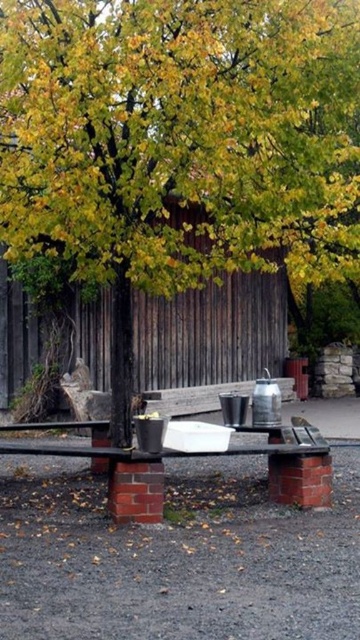
Which is more to the left, green leafy tree at center or wooden bench at center?

Positioned to the left is wooden bench at center.

Between green leafy tree at center and wooden bench at center, which one is positioned lower?

wooden bench at center is below.

Image resolution: width=360 pixels, height=640 pixels. What do you see at coordinates (177, 141) in the screenshot?
I see `green leafy tree at center` at bounding box center [177, 141].

The height and width of the screenshot is (640, 360). Find the location of `green leafy tree at center`. green leafy tree at center is located at coordinates (177, 141).

Can you confirm if wooden bench at center is taller than smooth wooden bench at center?

Yes, wooden bench at center is taller than smooth wooden bench at center.

What do you see at coordinates (210, 332) in the screenshot? I see `wooden bench at center` at bounding box center [210, 332].

Does point (140, 353) come farther from viewer compared to point (101, 456)?

Yes, point (140, 353) is behind point (101, 456).

This screenshot has width=360, height=640. I want to click on wooden bench at center, so click(210, 332).

Which is above, green leafy tree at center or smooth wooden bench at center?

green leafy tree at center is higher up.

Which is below, green leafy tree at center or smooth wooden bench at center?

smooth wooden bench at center is below.

In the scene shown: Measure the distance between green leafy tree at center and camera.

The distance of green leafy tree at center from camera is 20.11 feet.

Locate an element on the screen. The image size is (360, 640). green leafy tree at center is located at coordinates (177, 141).